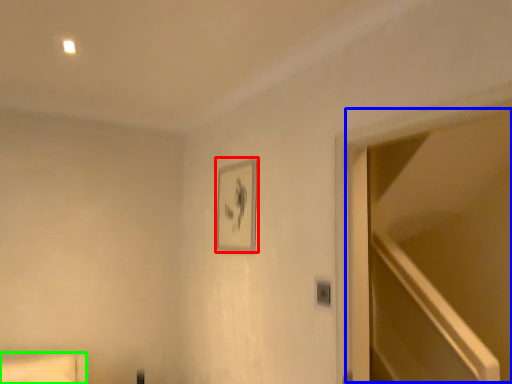
Question: Based on their relative distances, which object is farther from picture frame (highlighted by a red box)? Choose from glass door (highlighted by a blue box) and furniture (highlighted by a green box).

Choices:
 (A) glass door
 (B) furniture

Answer: (A)